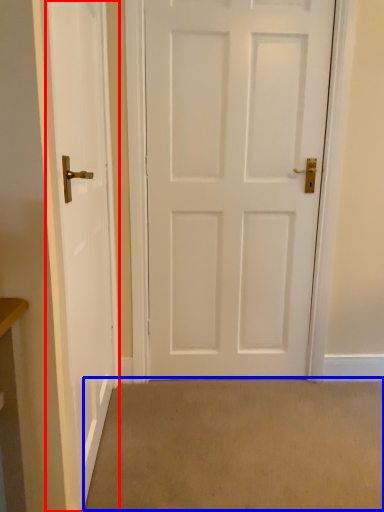
Question: Which object is closer to the camera taking this photo, door (highlighted by a red box) or plain (highlighted by a blue box)?

Choices:
 (A) door
 (B) plain

Answer: (A)